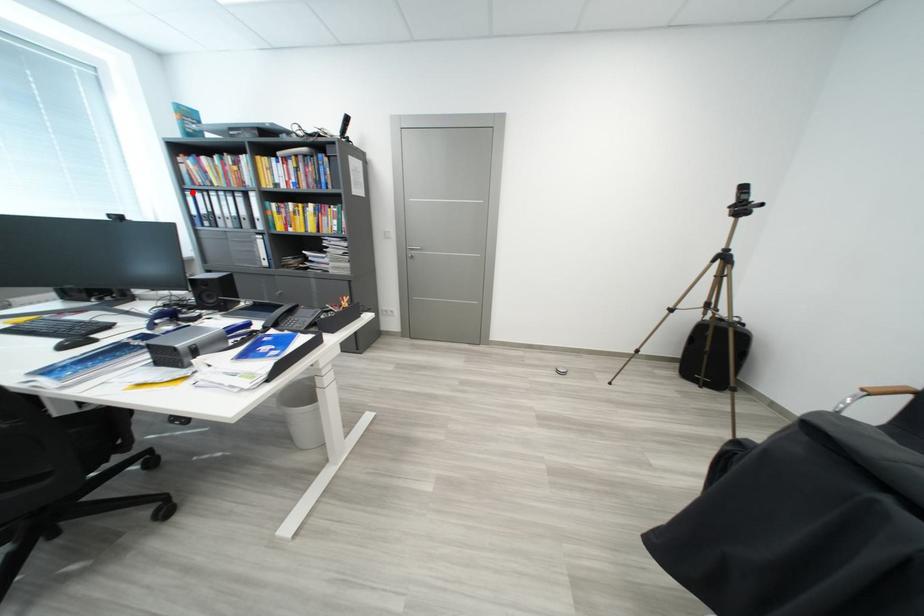
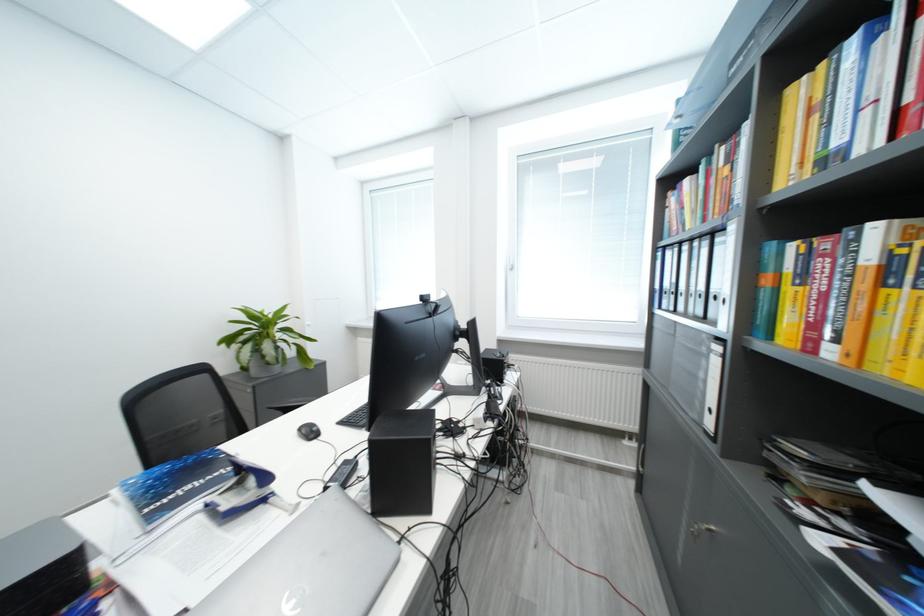
Question: I am providing you with two images of the same scene from different viewpoints. A red point is marked on the first image. Can you still see the location of the red point in image 2?

Choices:
 (A) Yes
 (B) No

Answer: (A)